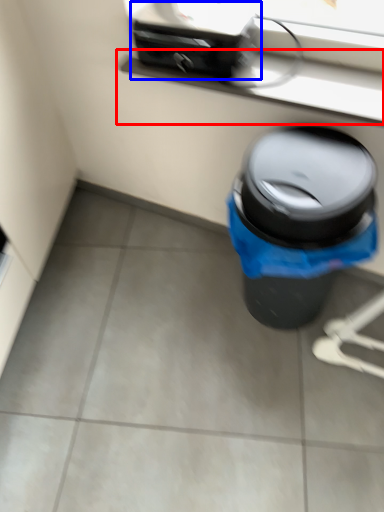
Question: Which of the following is the closest to the observer, window sill (highlighted by a red box) or appliance (highlighted by a blue box)?

Choices:
 (A) window sill
 (B) appliance

Answer: (A)